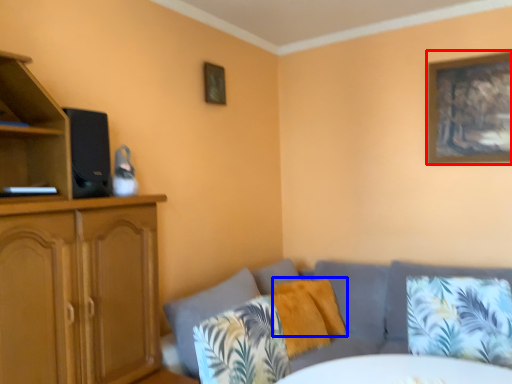
Question: Which object appears closest to the camera in this image, picture frame (highlighted by a red box) or pillow (highlighted by a blue box)?

Choices:
 (A) picture frame
 (B) pillow

Answer: (B)